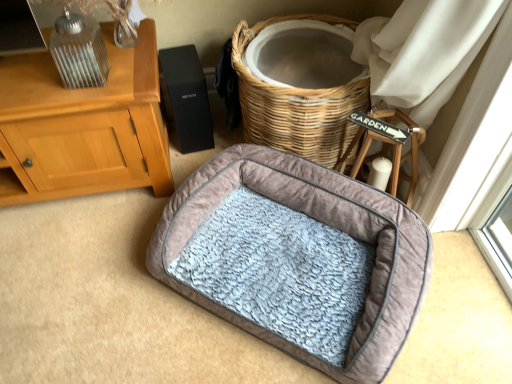
This screenshot has width=512, height=384. What are the coordinates of `vacant space positioned to the left of velvet-like gray dog bed at center` in the screenshot? It's located at (99, 282).